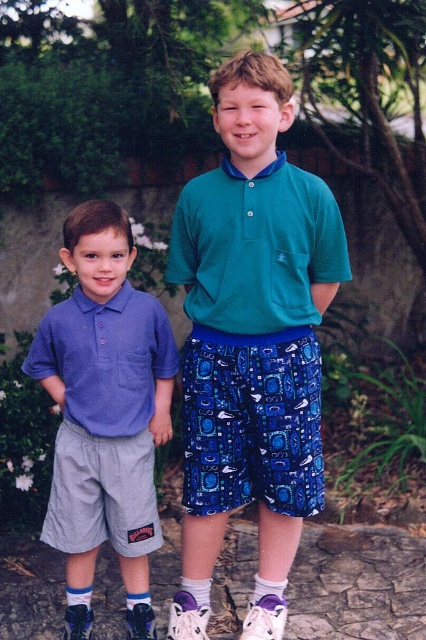
Does green matte polo shirt at center have a smaller size compared to matte blue polo shirt at center?

No, green matte polo shirt at center is not smaller than matte blue polo shirt at center.

Which is behind, point (327, 189) or point (97, 330)?

The point (97, 330) is more distant.

Does point (267, 314) lie in front of point (137, 340)?

That is True.

Locate an element on the screen. green matte polo shirt at center is located at coordinates (256, 248).

Is point (389, 605) more distant than point (271, 592)?

Yes.

Can you confirm if gray stone at lower center is positioned to the left of purple fabric sock at lower center?

Correct, you'll find gray stone at lower center to the left of purple fabric sock at lower center.

In order to click on gray stone at lower center in this screenshot , I will do `click(357, 584)`.

Who is higher up, green matte polo shirt at center or white cotton sock at lower center?

green matte polo shirt at center is above.

Is green matte polo shirt at center thinner than white cotton sock at lower center?

Incorrect, green matte polo shirt at center's width is not less than white cotton sock at lower center's.

Find the location of a particular element. Image resolution: width=426 pixels, height=640 pixels. green matte polo shirt at center is located at coordinates 256,248.